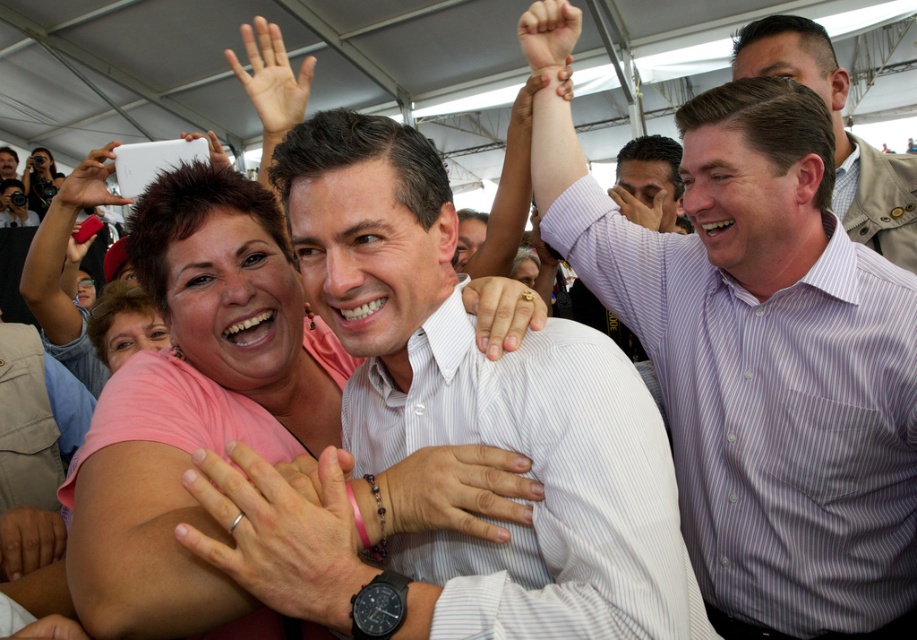
Based on the photo, is matte skin hand at upper center taller than white matte phone at upper left?

Yes.

Which is in front, point (639, 221) or point (224, 164)?

Point (224, 164) is more forward.

Identify the location of matte skin hand at upper center. This screenshot has width=917, height=640. (639, 205).

Which is below, pink matte shirt at center or gold ring at center?

pink matte shirt at center

Is point (274, 228) more distant than point (463, 307)?

Yes, it is behind point (463, 307).

Where is `pink matte shirt at center`? This screenshot has height=640, width=917. pink matte shirt at center is located at coordinates (242, 307).

The width and height of the screenshot is (917, 640). Find the location of `pink matte shirt at center`. pink matte shirt at center is located at coordinates (242, 307).

Can you confirm if white striped shirt at upper right is thinner than white plastic phone at upper left?

→ Indeed, white striped shirt at upper right has a lesser width compared to white plastic phone at upper left.

Between point (838, 141) and point (107, 147), which one is positioned in front?

Positioned in front is point (838, 141).

This screenshot has width=917, height=640. Find the location of `white striped shirt at upper right`. white striped shirt at upper right is located at coordinates (838, 134).

Where is `white striped shirt at upper right`? white striped shirt at upper right is located at coordinates (838, 134).